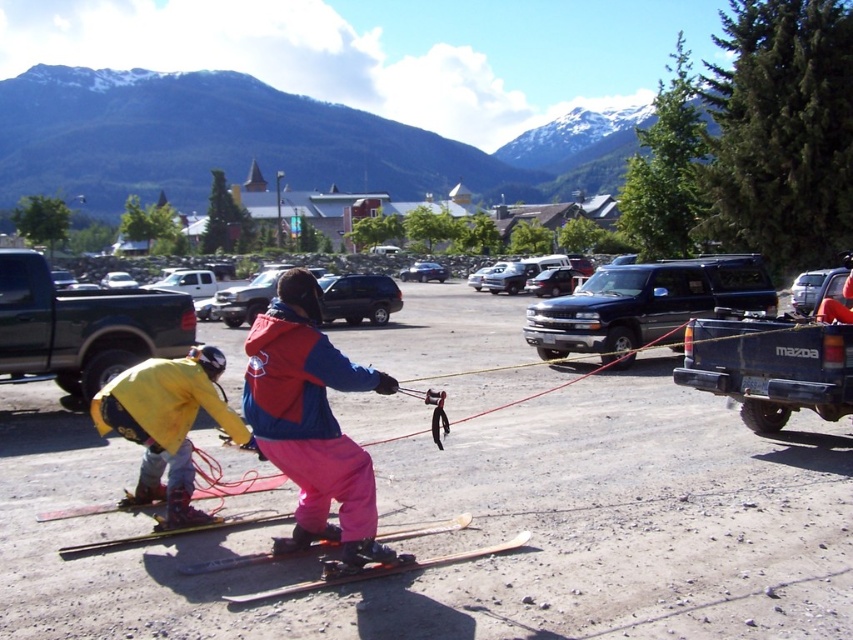
You are standing at the point labeled point (x=235, y=368) and want to walk to the point labeled point (x=383, y=570). Which direction should you face to walk directly towards your destination?

Since point (x=235, y=368) is behind point (x=383, y=570), you should face forward to walk directly towards point (x=383, y=570).

You are a photographer trying to capture a clear shot of the yellow matte jacket at lower left and the wooden skis at center. Since you want the jacket to appear bigger in the photo than the skis, which object should you move closer to the camera?

The yellow matte jacket at lower left is already larger in size than wooden skis at center. To ensure the jacket appears bigger in the photo, you should move the wooden skis at center further away from the camera or move the yellow matte jacket at lower left closer to the camera.